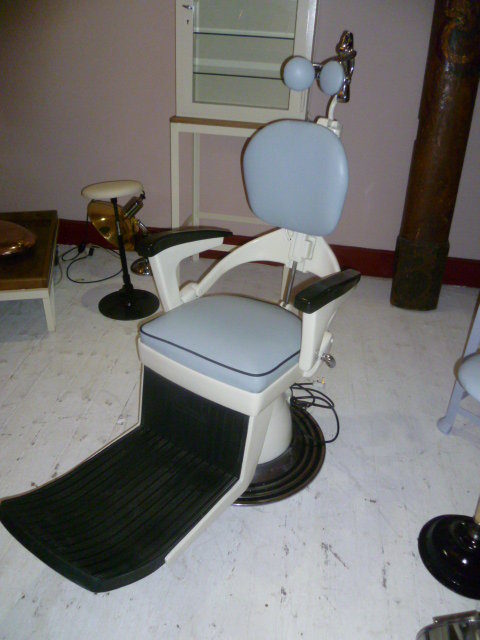
In order to click on chair in this screenshot , I will do `click(234, 339)`.